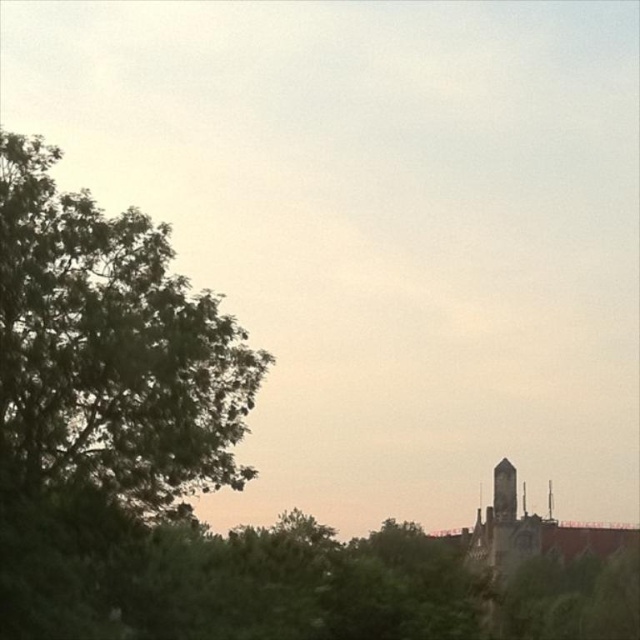
Can you confirm if green leafy tree at left is taller than smooth gray spire at upper right?

Correct, green leafy tree at left is much taller as smooth gray spire at upper right.

Is green leafy tree at left closer to the viewer compared to smooth gray spire at upper right?

That is True.

Find the location of a particular element. This screenshot has height=640, width=640. green leafy tree at left is located at coordinates (112, 348).

Who is taller, smooth gray spire at upper right or smooth stone spire at upper right?

smooth stone spire at upper right

What do you see at coordinates (548, 500) in the screenshot? I see `smooth gray spire at upper right` at bounding box center [548, 500].

Is point (552, 490) behind point (524, 499)?

That is True.

This screenshot has height=640, width=640. In order to click on smooth gray spire at upper right in this screenshot , I will do `click(548, 500)`.

Where is `smooth stone tower at right`? smooth stone tower at right is located at coordinates (504, 492).

Which is in front, point (506, 499) or point (522, 513)?

Point (522, 513) is more forward.

Is point (500, 506) farther from viewer compared to point (522, 490)?

Yes.

At what (x,y) coordinates should I click in order to perform the action: click on smooth stone tower at right. Please return your answer as a coordinate pair (x, y). The image size is (640, 640). Looking at the image, I should click on 504,492.